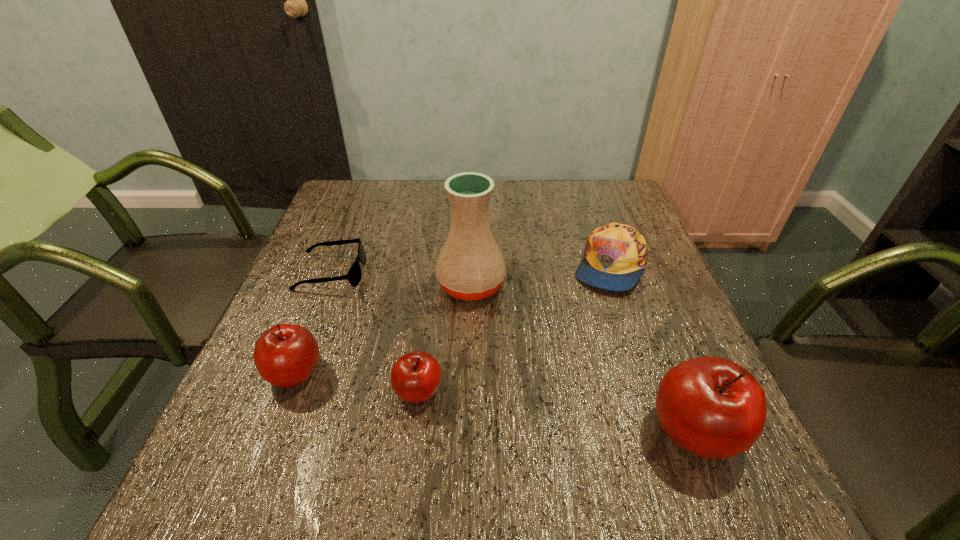
You are a GUI agent. You are given a task and a screenshot of the screen. Output one action in this format:
    pyautogui.click(x=<x>, y=<y>)
    Task: Click on the vacant space that satisfies the following two spatial constraints: 1. on the front-facing side of the tallest object; 2. on the right side of the sunglasses
    This screenshot has height=540, width=960.
    Given the screenshot: What is the action you would take?
    [326, 285]

Identify the location of vacant space that satisfies the following two spatial constraints: 1. on the front-facing side of the shortest object; 2. on the back side of the leftmost apple. [292, 373].

Find the location of `free space that satisfies the following two spatial constraints: 1. on the back side of the pottery; 2. on the right side of the leftmost apple`. free space that satisfies the following two spatial constraints: 1. on the back side of the pottery; 2. on the right side of the leftmost apple is located at coordinates (329, 285).

Find the location of a particular element. vacant space that satisfies the following two spatial constraints: 1. on the front-facing side of the second tallest object; 2. on the left side of the shortest object is located at coordinates (270, 431).

Identify the location of free space that satisfies the following two spatial constraints: 1. on the front-facing side of the second tallest object; 2. on the right side of the sunglasses. (270, 431).

The width and height of the screenshot is (960, 540). Find the location of `vacant position in the image that satisfies the following two spatial constraints: 1. on the front-facing side of the pottery; 2. on the left side of the shortest object`. vacant position in the image that satisfies the following two spatial constraints: 1. on the front-facing side of the pottery; 2. on the left side of the shortest object is located at coordinates (326, 285).

This screenshot has width=960, height=540. I want to click on blank area in the image that satisfies the following two spatial constraints: 1. on the front-facing side of the fifth shortest object; 2. on the left side of the sunglasses, so click(270, 431).